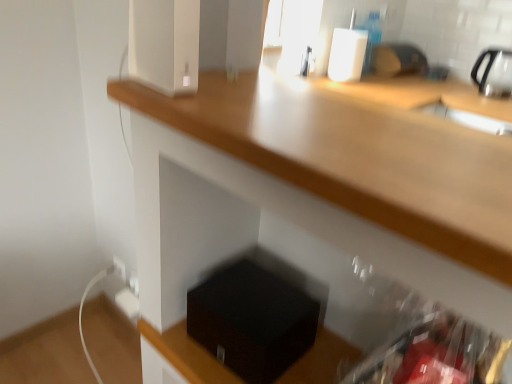
You are a GUI agent. You are given a task and a screenshot of the screen. Output one action in this format:
    pyautogui.click(x=<x>, y=<y>)
    Task: Click on the free spot above black matte box at lower center (from a real-world perspective)
    The height and width of the screenshot is (384, 512).
    Given the screenshot: What is the action you would take?
    pyautogui.click(x=253, y=297)